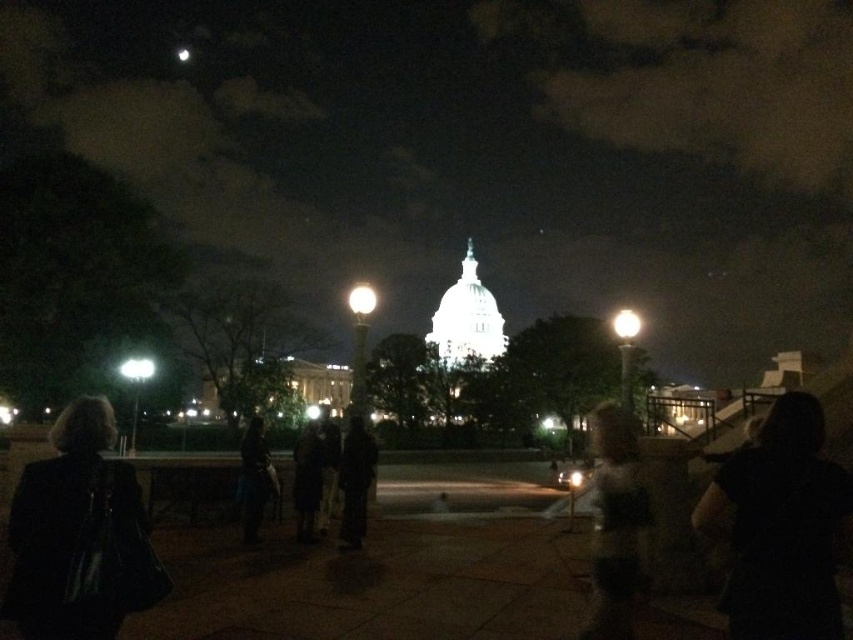
Does dark gray leather jacket at lower left appear under dark fabric coat at center?

Correct, dark gray leather jacket at lower left is located below dark fabric coat at center.

Can you confirm if dark gray leather jacket at lower left is taller than dark fabric coat at center?

Correct, dark gray leather jacket at lower left is much taller as dark fabric coat at center.

Locate an element on the screen. The width and height of the screenshot is (853, 640). dark gray leather jacket at lower left is located at coordinates (79, 536).

Looking at this image, does black fabric at center have a greater height compared to dark gray hoodie at lower right?

Yes, black fabric at center is taller than dark gray hoodie at lower right.

Can you confirm if black fabric at center is positioned to the left of dark gray hoodie at lower right?

No, black fabric at center is not to the left of dark gray hoodie at lower right.

This screenshot has width=853, height=640. I want to click on black fabric at center, so click(780, 525).

Can you confirm if dark gray leather jacket at lower left is positioned below dark gray hoodie at lower right?

Incorrect, dark gray leather jacket at lower left is not positioned below dark gray hoodie at lower right.

Which is below, dark gray leather jacket at lower left or dark gray hoodie at lower right?

dark gray hoodie at lower right is below.

At what (x,y) coordinates should I click in order to perform the action: click on dark gray leather jacket at lower left. Please return your answer as a coordinate pair (x, y). Image resolution: width=853 pixels, height=640 pixels. Looking at the image, I should click on [x=79, y=536].